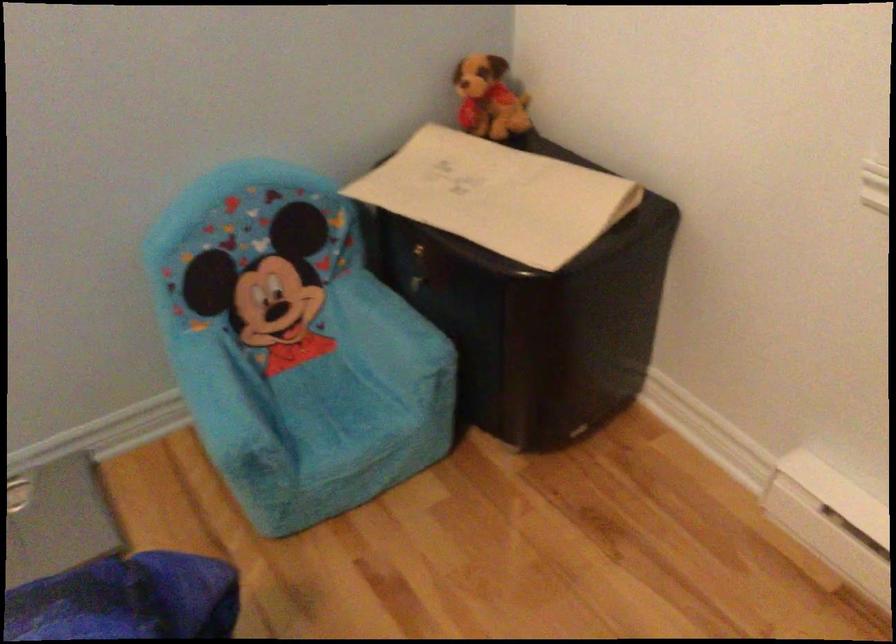
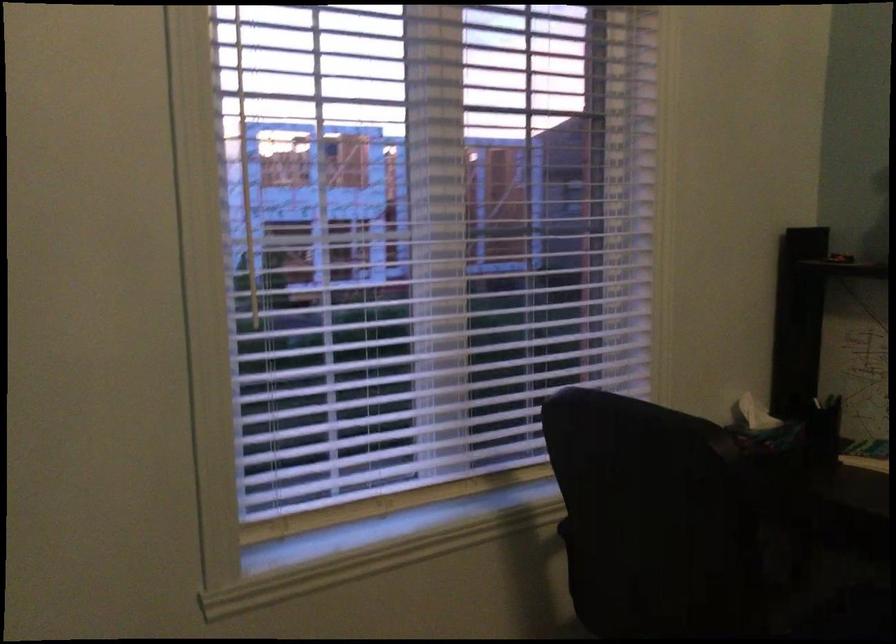
Question: Based on the continuous images, in which direction is the camera rotating? Reply with the corresponding letter.

Choices:
 (A) Left
 (B) Right
 (C) Up
 (D) Down

Answer: (B)